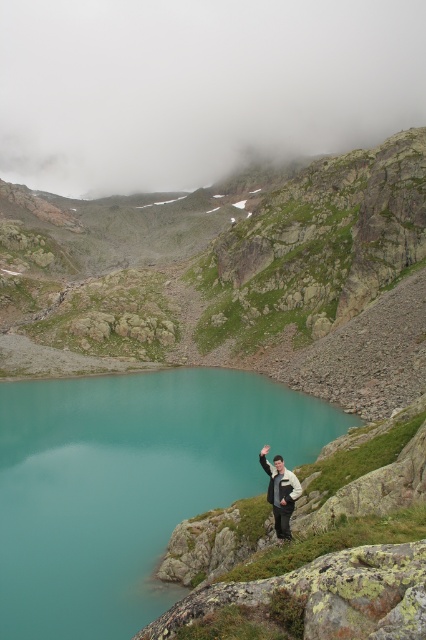
You are planning to cross the teal glassy lake at center to reach the white fleece jacket at lower right. Based on the scene, can you estimate whether the lake is wide enough for a standard kayak to traverse?

The teal glassy lake at center might be wider than white fleece jacket at lower right, but without specific measurements, it is uncertain if a standard kayak can traverse the lake. Additional information about the lake width is needed.

You are a photographer standing at the edge of the lake in the scene. You want to take a photo that includes both the person and a distant mountain peak. The person is at point [48,605] and the mountain peak is at point [287,490]. Which point should you focus on first to ensure both are in focus?

You should focus on point [287,490] first because it is farther from the camera than point [48,605]. By focusing on the distant mountain peak, the person closer to the camera will also be within the depth of field, ensuring both are in focus.

You are standing at the edge of the teal glassy lake at center. If you walk straight ahead, will you eventually reach the rocky edge where the person is standing?

Yes, because the teal glassy lake at center is located at point (129,484), which is centrally positioned, so walking straight from the edge would lead towards the person on the rocky edge.